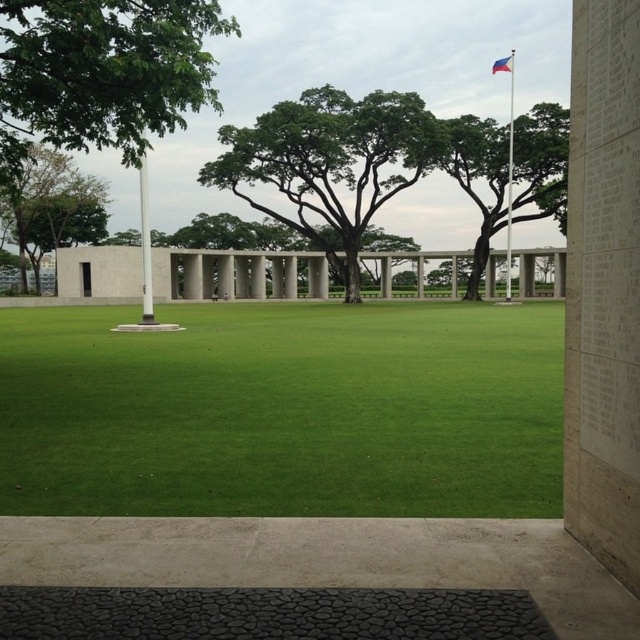
You are standing in the outdoor space and want to take a photo that includes both the white stone wall at right and the green leafy tree at upper center. Which object should you position closer to the edge of your camera frame to ensure both are fully visible?

Since the white stone wall at right is smaller than the green leafy tree at upper center, you should position the white stone wall at right closer to the edge of your camera frame to ensure both are fully visible.

You are planning to place a small bench between the green leafy tree at upper center and the white polished stone pillar at center. Which object will have more space around it after placing the bench?

The white polished stone pillar at center will have more space around it because the green leafy tree at upper center is thinner than the white polished stone pillar at center, meaning the pillar occupies more area and thus leaves more space when the bench is placed between them.

You are planning to install a new bench in the memorial park. The bench requires a minimum of 80 feet of space between any two objects to ensure visitors have enough room to move comfortably. Given the current placement of the green leafy tree at center and the white metallic flag pole at upper right, is this requirement met?

The green leafy tree at center and the white metallic flag pole at upper right are 75.90 feet apart from each other. Since 75.90 feet is less than the required 80 feet, the minimum spacing requirement is not met.